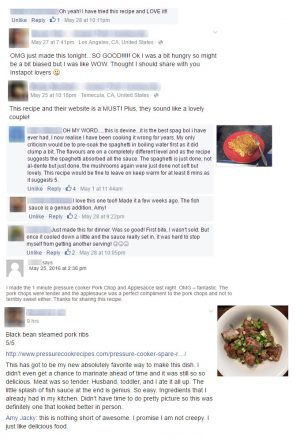
In order to click on plates in this screenshot , I will do `click(281, 336)`, `click(230, 156)`.